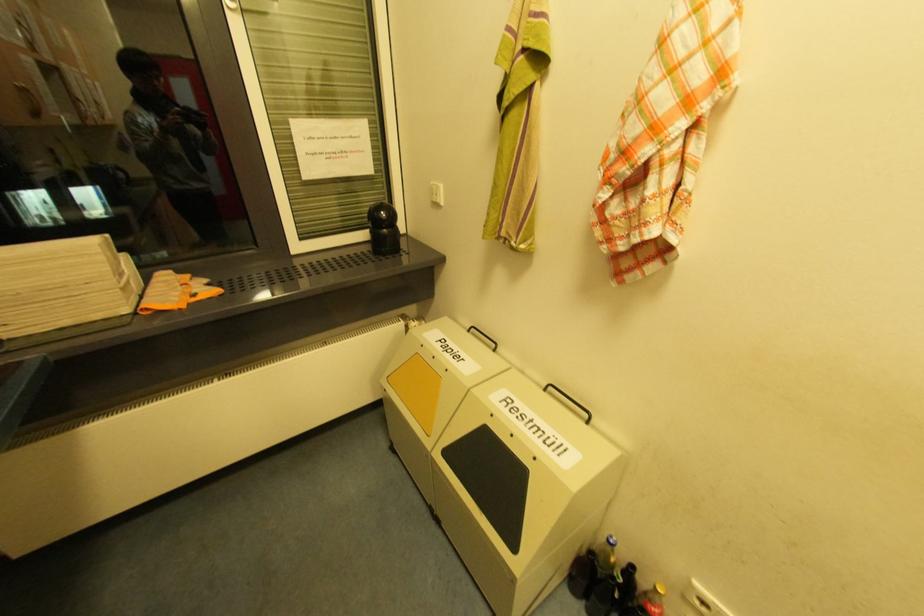
Image resolution: width=924 pixels, height=616 pixels. What do you see at coordinates (569, 400) in the screenshot?
I see `the black bin lid handle` at bounding box center [569, 400].